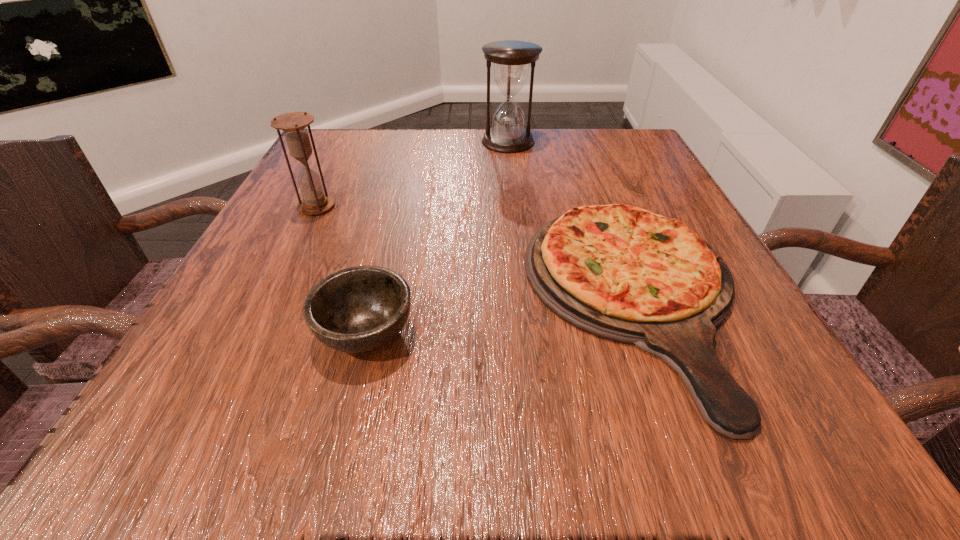
Find the location of a particular element. This screenshot has width=960, height=540. the taller hourglass is located at coordinates (511, 58).

Where is `the farthest object`? The image size is (960, 540). the farthest object is located at coordinates 511,58.

Locate an element on the screen. the third shortest object is located at coordinates (294, 124).

In order to click on the nearer hourglass in this screenshot , I will do `click(294, 124)`.

You are a GUI agent. You are given a task and a screenshot of the screen. Output one action in this format:
    pyautogui.click(x=<x>, y=<y>)
    Task: Click on the third object from right to left
    The image size is (960, 540).
    Given the screenshot: What is the action you would take?
    pyautogui.click(x=359, y=309)

At what (x,y) coordinates should I click in order to perform the action: click on the third tallest object. Please return your answer as a coordinate pair (x, y). The image size is (960, 540). Looking at the image, I should click on (359, 309).

In order to click on pizza in this screenshot , I will do `click(622, 273)`.

What are the coordinates of `vacant area located 0.080m on the left of the taller hourglass` in the screenshot? It's located at (448, 141).

Where is `vacant position located on the front of the nearer hourglass`? vacant position located on the front of the nearer hourglass is located at coordinates (273, 295).

Where is `free space located 0.290m on the right of the second object from left to right`? Image resolution: width=960 pixels, height=540 pixels. free space located 0.290m on the right of the second object from left to right is located at coordinates (623, 332).